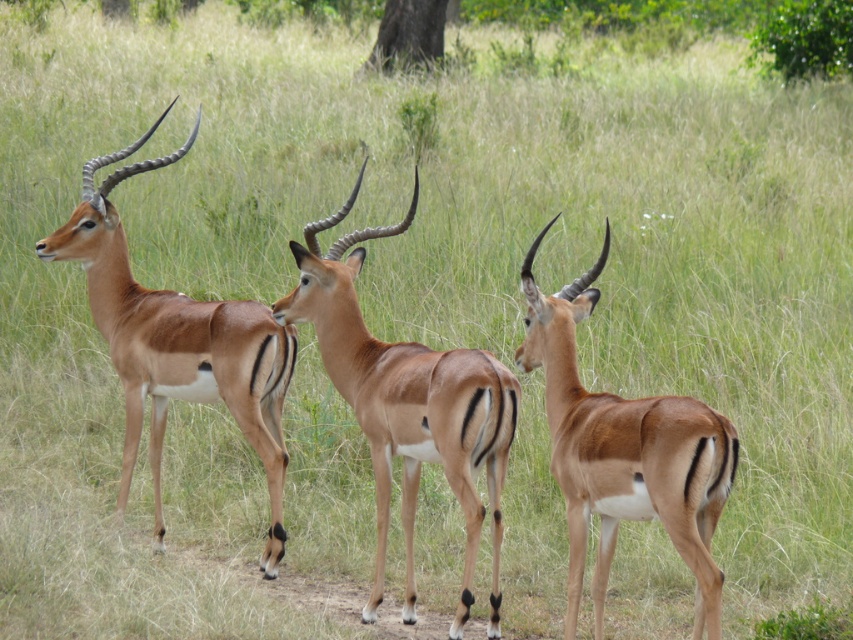
Does brown glossy antelope at left appear under brown rough tree trunk at upper center?

Yes, brown glossy antelope at left is below brown rough tree trunk at upper center.

Consider the image. Who is higher up, brown glossy antelope at left or brown rough tree trunk at upper center?

brown rough tree trunk at upper center is higher up.

Which is behind, point (102, 189) or point (375, 44)?

The point (375, 44) is more distant.

The width and height of the screenshot is (853, 640). I want to click on brown glossy antelope at left, so click(177, 342).

Is brown matte/deer at center shorter than brown glossy antelope at left?

Yes.

Does brown matte/deer at center have a greater height compared to brown glossy antelope at left?

Incorrect, brown matte/deer at center's height is not larger of brown glossy antelope at left's.

Which is in front, point (722, 493) or point (218, 339)?

Point (722, 493) is more forward.

Locate an element on the screen. The height and width of the screenshot is (640, 853). brown matte/deer at center is located at coordinates (624, 452).

Which is in front, point (677, 433) or point (386, 20)?

Point (677, 433) is more forward.

Can you confirm if brown matte/deer at center is wider than brown rough tree trunk at upper center?

No.

Which is in front, point (598, 577) or point (421, 35)?

Point (598, 577) is in front.

This screenshot has width=853, height=640. Identify the location of brown matte/deer at center. (624, 452).